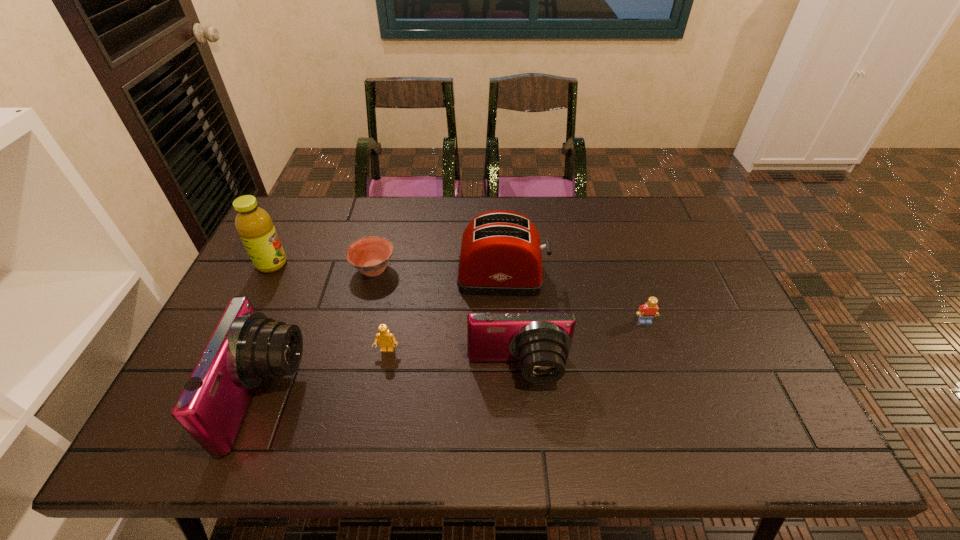
Where is `empty location between the fourth shortest object and the tallest object`? The image size is (960, 540). empty location between the fourth shortest object and the tallest object is located at coordinates (396, 318).

Find the location of a particular element. blank region between the left Lego and the taller camera is located at coordinates (327, 373).

You are a GUI agent. You are given a task and a screenshot of the screen. Output one action in this format:
    pyautogui.click(x=<x>, y=<y>)
    Task: Click on the unoccupied position between the leftmost object and the fourth tallest object
    Image resolution: width=960 pixels, height=540 pixels.
    Given the screenshot: What is the action you would take?
    pyautogui.click(x=396, y=318)

Select which object is the closest to the toaster. Please provide its 2D coordinates. Your answer should be formatted as a tuple, i.e. [(x, y)], where the tuple contains the x and y coordinates of a point satisfying the conditions above.

[(540, 341)]

At what (x,y) coordinates should I click in order to perform the action: click on object that is the closest to the left Lego. Please return your answer as a coordinate pair (x, y). This screenshot has height=540, width=960. Looking at the image, I should click on (246, 348).

Find the location of a particular element. blank space that satisfies the following two spatial constraints: 1. on the face of the left Lego; 2. on the front-facing side of the sixth object from right to left is located at coordinates (379, 396).

Where is `vacant space that satisfies the following two spatial constraints: 1. on the front label of the fruit juice; 2. on the back side of the shortest object`? vacant space that satisfies the following two spatial constraints: 1. on the front label of the fruit juice; 2. on the back side of the shortest object is located at coordinates (270, 269).